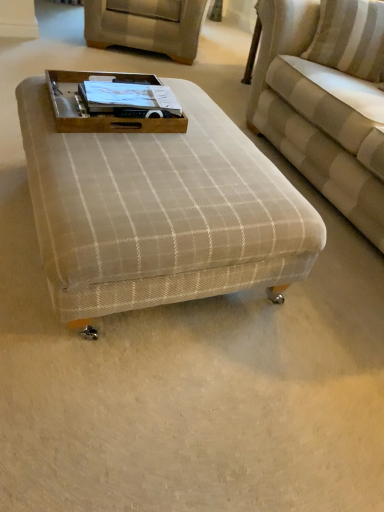
Question: Based on their sizes in the image, would you say beige fabric swivel chair at upper center is bigger or smaller than beige striped fabric couch at upper right?

Choices:
 (A) small
 (B) big

Answer: (A)

Question: Is beige fabric swivel chair at upper center wider or thinner than beige striped fabric couch at upper right?

Choices:
 (A) thin
 (B) wide

Answer: (A)

Question: Estimate the real-world distances between objects in this image. Which object is farther from the beige plaid ottoman at center?

Choices:
 (A) beige striped fabric couch at upper right
 (B) beige fabric swivel chair at upper center
 (C) brown wooden tray at center
 (D) white striped pillow at upper right

Answer: (B)

Question: Which of these objects is positioned farthest from the beige striped fabric couch at upper right?

Choices:
 (A) beige fabric swivel chair at upper center
 (B) white striped pillow at upper right
 (C) brown wooden tray at center
 (D) beige plaid ottoman at center

Answer: (A)